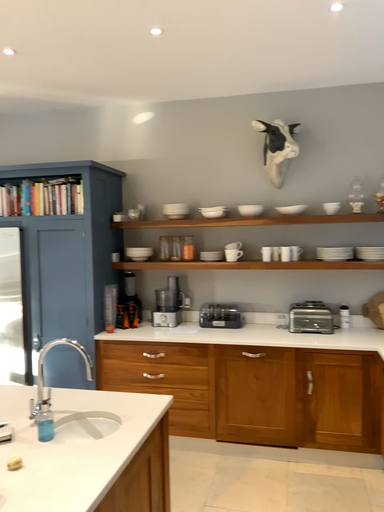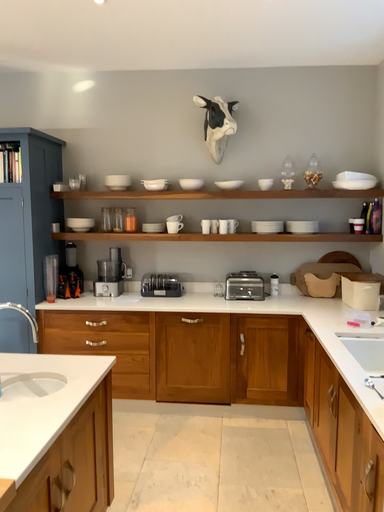
Question: How did the camera likely rotate when shooting the video?

Choices:
 (A) rotated right
 (B) rotated left

Answer: (A)